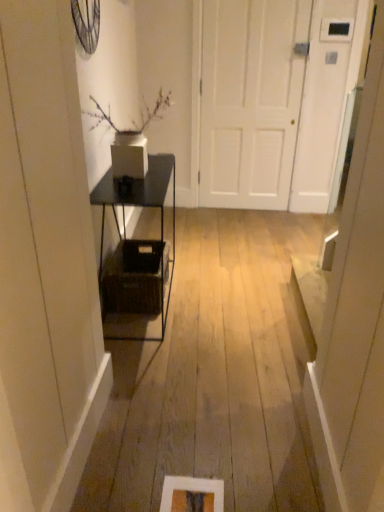
Question: Does black metal shelf at center have a greater width compared to brown woven basket at center?

Choices:
 (A) no
 (B) yes

Answer: (B)

Question: Is black metal shelf at center directly adjacent to brown woven basket at center?

Choices:
 (A) no
 (B) yes

Answer: (A)

Question: Does black metal shelf at center have a greater height compared to brown woven basket at center?

Choices:
 (A) yes
 (B) no

Answer: (A)

Question: Is black metal shelf at center far away from brown woven basket at center?

Choices:
 (A) no
 (B) yes

Answer: (A)

Question: From the image's perspective, does black metal shelf at center appear lower than brown woven basket at center?

Choices:
 (A) yes
 (B) no

Answer: (B)

Question: From their relative heights in the image, would you say black metal shelf at center is taller or shorter than brown woven basket at center?

Choices:
 (A) short
 (B) tall

Answer: (B)

Question: From a real-world perspective, is black metal shelf at center positioned above or below brown woven basket at center?

Choices:
 (A) below
 (B) above

Answer: (B)

Question: Considering their positions, is black metal shelf at center located in front of or behind brown woven basket at center?

Choices:
 (A) behind
 (B) front

Answer: (B)

Question: From the image's perspective, is black metal shelf at center located above or below brown woven basket at center?

Choices:
 (A) above
 (B) below

Answer: (A)

Question: From the image's perspective, is black metal shelf at center located above or below white matte door at center?

Choices:
 (A) above
 (B) below

Answer: (B)

Question: Based on their sizes in the image, would you say black metal shelf at center is bigger or smaller than white matte door at center?

Choices:
 (A) small
 (B) big

Answer: (B)

Question: From a real-world perspective, is black metal shelf at center above or below white matte door at center?

Choices:
 (A) below
 (B) above

Answer: (A)

Question: Is black metal shelf at center taller or shorter than white matte door at center?

Choices:
 (A) short
 (B) tall

Answer: (A)

Question: In the image, is brown woven basket at center positioned in front of or behind white matte door at center?

Choices:
 (A) front
 (B) behind

Answer: (A)

Question: From a real-world perspective, is brown woven basket at center physically located above or below white matte door at center?

Choices:
 (A) above
 (B) below

Answer: (B)